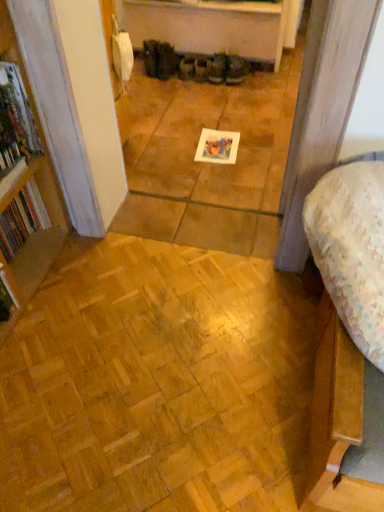
Question: Is matte brown boot at center looking in the opposite direction of natural wood parquet floor at lower left?

Choices:
 (A) no
 (B) yes

Answer: (A)

Question: Can you confirm if matte brown boot at center is positioned to the left of natural wood parquet floor at lower left?

Choices:
 (A) no
 (B) yes

Answer: (A)

Question: Is matte brown boot at center at the right side of natural wood parquet floor at lower left?

Choices:
 (A) no
 (B) yes

Answer: (B)

Question: Can you confirm if matte brown boot at center is wider than natural wood parquet floor at lower left?

Choices:
 (A) no
 (B) yes

Answer: (A)

Question: Can you confirm if matte brown boot at center is smaller than natural wood parquet floor at lower left?

Choices:
 (A) yes
 (B) no

Answer: (A)

Question: Is the position of matte brown boot at center less distant than that of natural wood parquet floor at lower left?

Choices:
 (A) no
 (B) yes

Answer: (A)

Question: Considering the relative sizes of hardcover book at left, which ranks as the second book in back-to-front order, and hardcover book at left, the second book from the front, in the image provided, is hardcover book at left, which ranks as the second book in back-to-front order, shorter than hardcover book at left, the second book from the front,?

Choices:
 (A) yes
 (B) no

Answer: (B)

Question: Can you confirm if hardcover book at left, which ranks as the second book in back-to-front order, is thinner than hardcover book at left, the second book from the front?

Choices:
 (A) yes
 (B) no

Answer: (A)

Question: Does hardcover book at left, which ranks as the second book in back-to-front order, appear on the left side of hardcover book at left, the second book from the front?

Choices:
 (A) yes
 (B) no

Answer: (B)

Question: Is hardcover book at left, arranged as the first book when viewed from the front, placed right next to hardcover book at left, the second book from the front?

Choices:
 (A) no
 (B) yes

Answer: (A)

Question: Can you confirm if hardcover book at left, arranged as the first book when viewed from the front, is smaller than hardcover book at left, the second book from the front?

Choices:
 (A) no
 (B) yes

Answer: (B)

Question: Is hardcover book at left, arranged as the first book when viewed from the front, positioned in front of hardcover book at left, the second book from the front?

Choices:
 (A) no
 (B) yes

Answer: (B)

Question: Is floral fabric bed at lower right oriented towards hardcover book at left, which ranks as the second book in back-to-front order?

Choices:
 (A) yes
 (B) no

Answer: (B)